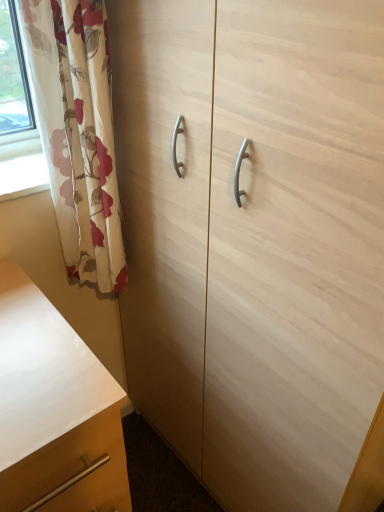
Question: Is floral fabric curtain at left surrounding matte wood chest of drawers at lower left?

Choices:
 (A) yes
 (B) no

Answer: (B)

Question: Is matte wood chest of drawers at lower left at the back of floral fabric curtain at left?

Choices:
 (A) yes
 (B) no

Answer: (B)

Question: Is floral fabric curtain at left to the right of matte wood chest of drawers at lower left from the viewer's perspective?

Choices:
 (A) no
 (B) yes

Answer: (B)

Question: Is floral fabric curtain at left to the left of matte wood chest of drawers at lower left from the viewer's perspective?

Choices:
 (A) no
 (B) yes

Answer: (A)

Question: Does floral fabric curtain at left have a smaller size compared to matte wood chest of drawers at lower left?

Choices:
 (A) yes
 (B) no

Answer: (A)

Question: Could you tell me if floral fabric curtain at left is turned towards matte wood chest of drawers at lower left?

Choices:
 (A) yes
 (B) no

Answer: (B)

Question: Is the depth of matte wood chest of drawers at lower left greater than that of floral fabric curtain at left?

Choices:
 (A) yes
 (B) no

Answer: (B)

Question: Is matte wood chest of drawers at lower left next to floral fabric curtain at left?

Choices:
 (A) yes
 (B) no

Answer: (B)

Question: Does matte wood chest of drawers at lower left appear on the right side of floral fabric curtain at left?

Choices:
 (A) no
 (B) yes

Answer: (A)

Question: From a real-world perspective, is matte wood chest of drawers at lower left physically above floral fabric curtain at left?

Choices:
 (A) yes
 (B) no

Answer: (B)

Question: From the image's perspective, is matte wood chest of drawers at lower left on floral fabric curtain at left?

Choices:
 (A) no
 (B) yes

Answer: (A)

Question: Is matte wood chest of drawers at lower left shorter than floral fabric curtain at left?

Choices:
 (A) yes
 (B) no

Answer: (B)

Question: Is floral fabric curtain at left in contact with light wood cabinet at center?

Choices:
 (A) yes
 (B) no

Answer: (B)